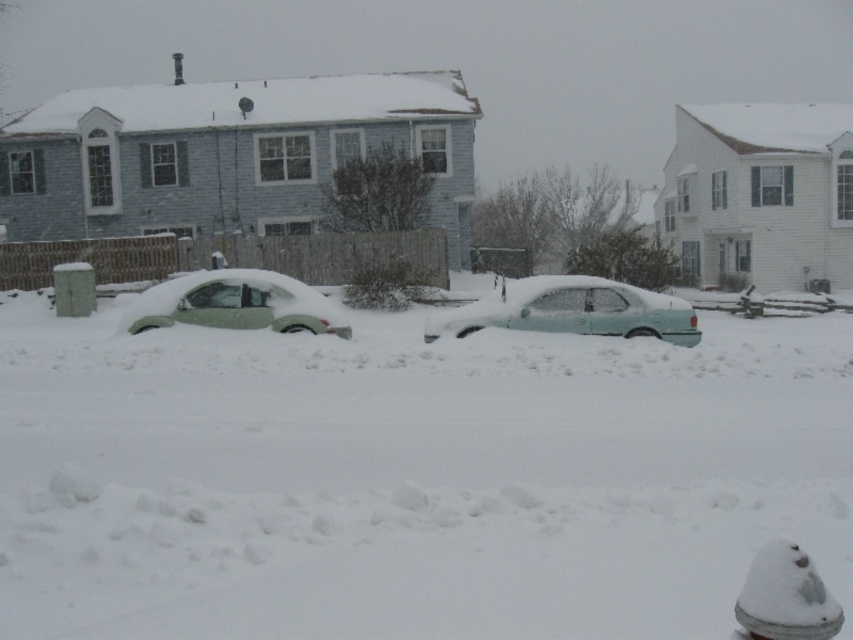
In the scene shown: You are a delivery person trying to deliver a package to the house in the background. You see the white fluffy snow at center and the light blue matte car at center. Which one is bigger in size?

The white fluffy snow at center is larger in size compared to the light blue matte car at center.